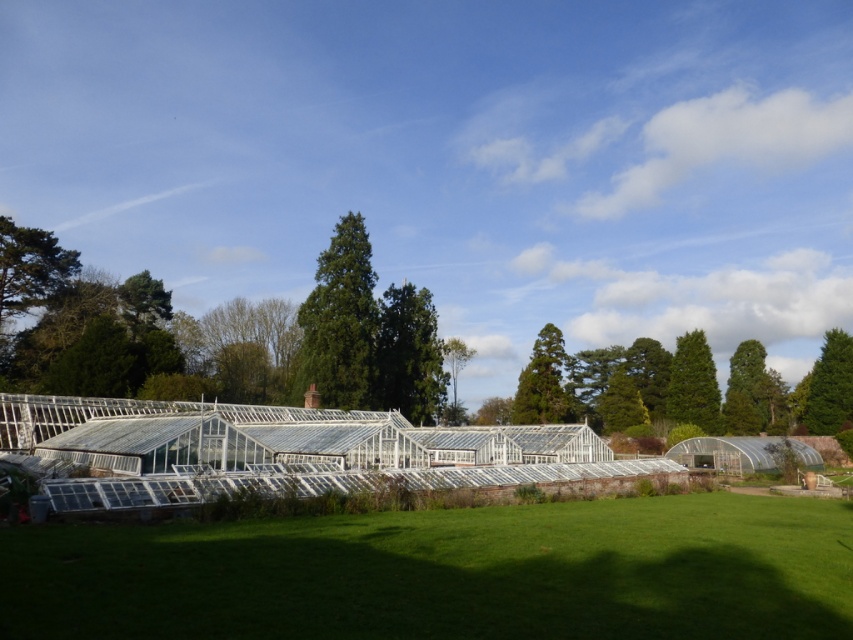
You are standing at the entrance of the greenhouse complex and want to find the green textured tree at center. According to the coordinates provided, which direction should you look to locate it?

The green textured tree at center is located at coordinates point [408,355], which is slightly to the right and above the center point of the image. Therefore, you should look towards the upper right direction from the center to find it.

You are standing at the point marked by the coordinates point (x=408, y=355) in the greenhouse complex. What is the object located at this point?

The point (x=408, y=355) marks a green textured tree at center.

You are planning to plant a new flower bed between the green textured tree at center and the green leafy tree at upper right. Given their widths, which tree will require more space to accommodate its spread?

The green leafy tree at upper right requires more space because its width is greater than the green textured tree at center.